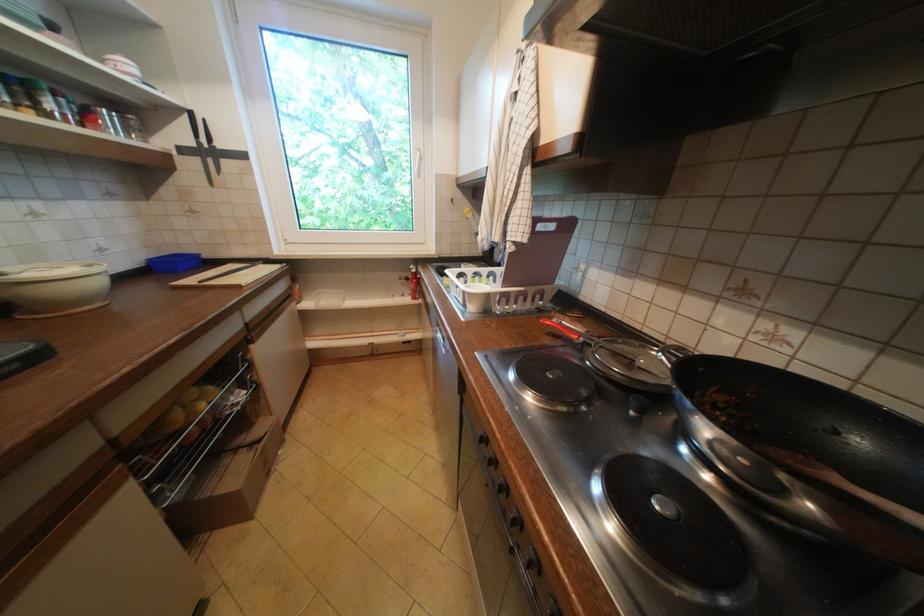
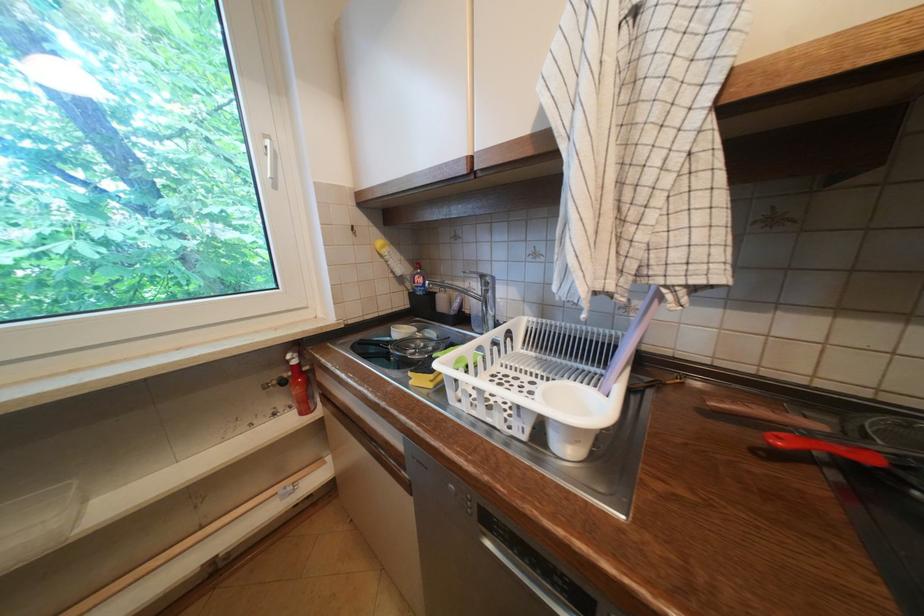
Find the pixel in the second image that matches the point at 478,221 in the first image.

(394, 259)